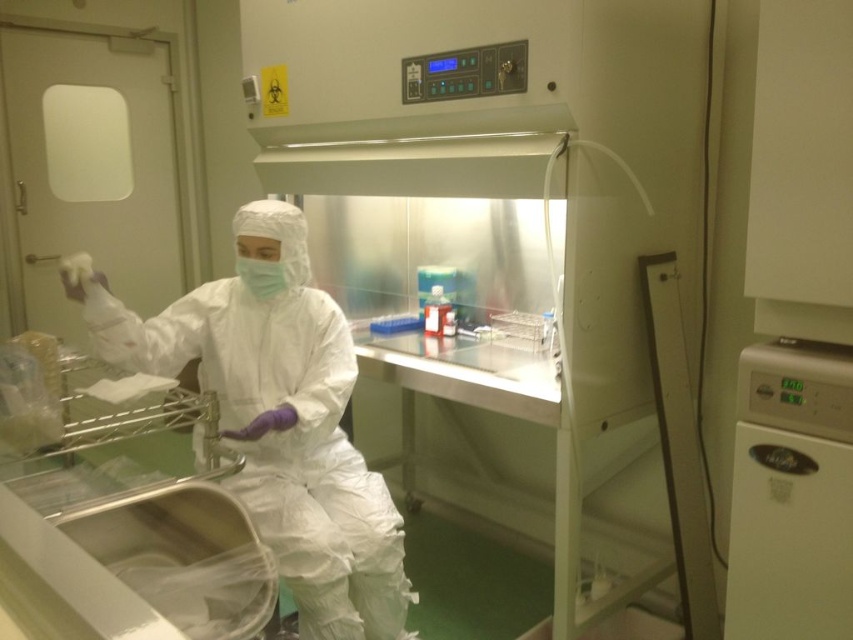
Between white matte/soft fabric at center and green matte mask at center, which one has less height?

With less height is green matte mask at center.

Who is more forward, (303, 330) or (282, 282)?

Positioned in front is point (282, 282).

Between point (99, 328) and point (264, 282), which one is positioned behind?

Point (264, 282)

Locate an element on the screen. The image size is (853, 640). white matte/soft fabric at center is located at coordinates (280, 422).